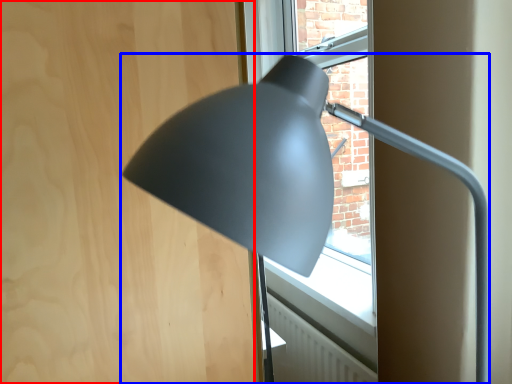
Question: Among these objects, which one is nearest to the camera, plywood (highlighted by a red box) or lamp (highlighted by a blue box)?

Choices:
 (A) plywood
 (B) lamp

Answer: (B)